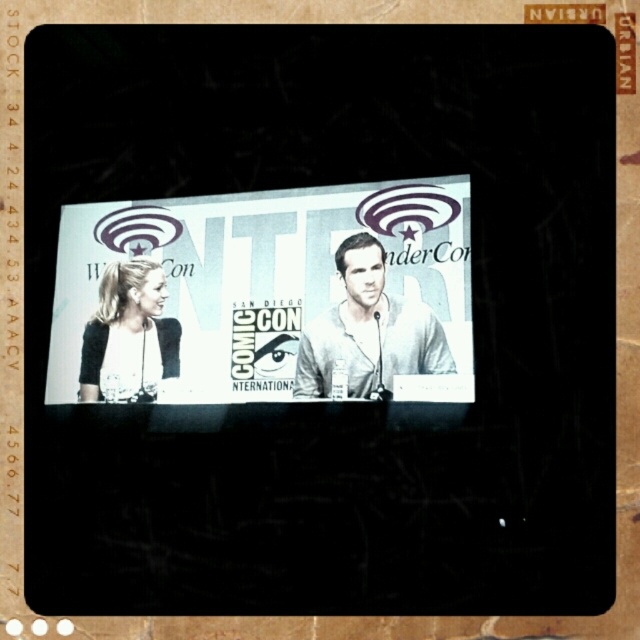
You are a virtual attendee at Comic Con and want to focus on the two points on the screen. Which point, point (160, 356) or point (346, 298), is closer to you?

Point (160, 356) is closer to you than point (346, 298) because it is further to the viewer.

You are an event organizer at Comic Con and need to ensure that the white paper poster at center and the light gray shirt at center are visible to the audience. Based on the scene, which object is wider and thus more likely to be seen clearly from a distance?

The white paper poster at center is wider than the light gray shirt at center, making it more visible from a distance.